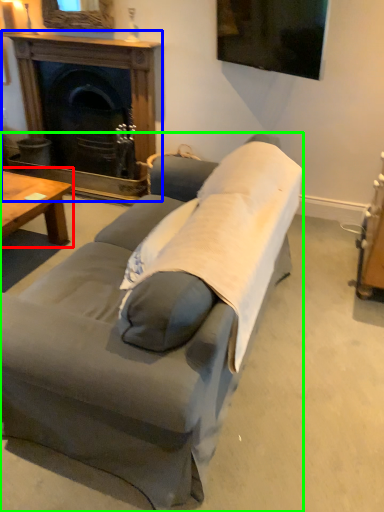
Question: Estimate the real-world distances between objects in this image. Which object is farther from coffee table (highlighted by a red box), fireplace (highlighted by a blue box) or studio couch (highlighted by a green box)?

Choices:
 (A) fireplace
 (B) studio couch

Answer: (B)